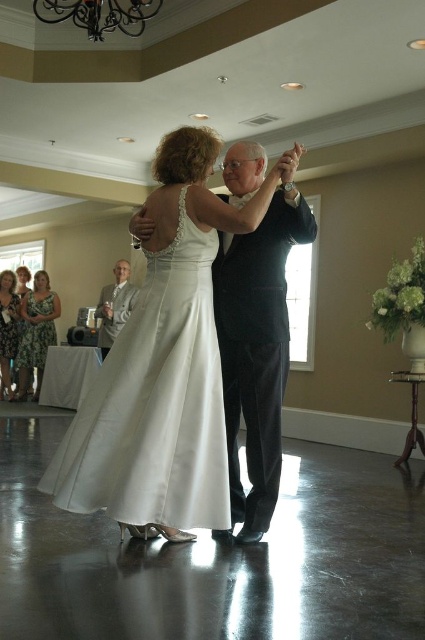
Question: Is black satin suit at center wider than printed floral dress at lower left?

Choices:
 (A) no
 (B) yes

Answer: (B)

Question: Does satin white dress at center appear on the left side of white satin dress at lower left?

Choices:
 (A) no
 (B) yes

Answer: (A)

Question: Which object is the closest to the printed fabric dress at lower left?

Choices:
 (A) satin white dress at center
 (B) black satin suit at center

Answer: (A)

Question: Estimate the real-world distances between objects in this image. Which object is farther from the satin white dress at center?

Choices:
 (A) printed floral dress at lower left
 (B) printed fabric dress at lower left
 (C) gray suit at left
 (D) black satin suit at center

Answer: (A)

Question: Where is gray suit at left located in relation to printed floral dress at lower left in the image?

Choices:
 (A) left
 (B) right

Answer: (B)

Question: Considering the real-world distances, which object is farthest from the black satin suit at center?

Choices:
 (A) white satin dress at lower left
 (B) satin white dress at center

Answer: (A)